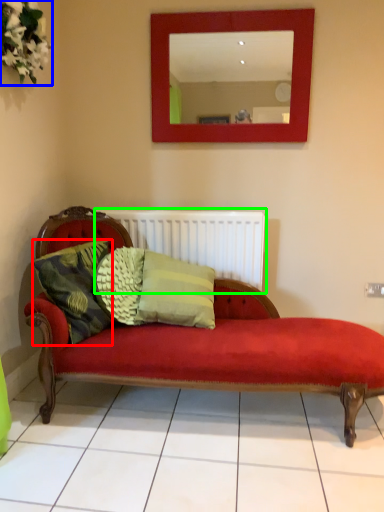
Question: Which object is the closest to the pillow (highlighted by a red box)? Choose among these: floral arrangement (highlighted by a blue box) or radiator (highlighted by a green box).

Choices:
 (A) floral arrangement
 (B) radiator

Answer: (B)